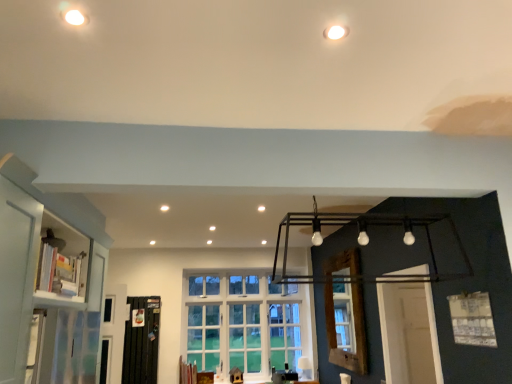
Question: Is black metal screen door at lower left positioned far away from white glass window at center, the first window in the left-to-right sequence?

Choices:
 (A) yes
 (B) no

Answer: (A)

Question: Does black metal screen door at lower left have a lesser height compared to white glass window at center, which is the 2th window in right-to-left order?

Choices:
 (A) yes
 (B) no

Answer: (A)

Question: Is black metal screen door at lower left not inside white glass window at center, which is the 2th window in right-to-left order?

Choices:
 (A) no
 (B) yes

Answer: (B)

Question: Considering the relative sizes of black metal screen door at lower left and white glass window at center, marked as the second window in a top-to-bottom arrangement, in the image provided, is black metal screen door at lower left wider than white glass window at center, marked as the second window in a top-to-bottom arrangement,?

Choices:
 (A) yes
 (B) no

Answer: (B)

Question: Is black metal screen door at lower left aimed at white glass window at center, marked as the second window in a top-to-bottom arrangement?

Choices:
 (A) yes
 (B) no

Answer: (B)

Question: Would you say white glossy bookshelf at left is to the left or to the right of wooden window frame at center in the picture?

Choices:
 (A) left
 (B) right

Answer: (A)

Question: Based on their sizes in the image, would you say white glossy bookshelf at left is bigger or smaller than wooden window frame at center?

Choices:
 (A) big
 (B) small

Answer: (B)

Question: Considering the positions of white glossy bookshelf at left and wooden window frame at center in the image, is white glossy bookshelf at left taller or shorter than wooden window frame at center?

Choices:
 (A) tall
 (B) short

Answer: (B)

Question: Relative to wooden window frame at center, is white glossy bookshelf at left in front or behind?

Choices:
 (A) behind
 (B) front

Answer: (B)

Question: From a real-world perspective, relative to black metal screen door at lower left, is white glossy bookshelf at left vertically above or below?

Choices:
 (A) below
 (B) above

Answer: (B)

Question: From their relative heights in the image, would you say white glossy bookshelf at left is taller or shorter than black metal screen door at lower left?

Choices:
 (A) tall
 (B) short

Answer: (A)

Question: Choose the correct answer: Is white glossy bookshelf at left inside black metal screen door at lower left or outside it?

Choices:
 (A) outside
 (B) inside

Answer: (A)

Question: In terms of width, does white glossy bookshelf at left look wider or thinner when compared to black metal screen door at lower left?

Choices:
 (A) thin
 (B) wide

Answer: (B)

Question: Is white glossy bookshelf at left inside the boundaries of white glass window at center, which is the 1th window in bottom-to-top order, or outside?

Choices:
 (A) inside
 (B) outside

Answer: (B)

Question: Considering the positions of white glossy bookshelf at left and white glass window at center, which is the second window in front-to-back order, in the image, is white glossy bookshelf at left wider or thinner than white glass window at center, which is the second window in front-to-back order,?

Choices:
 (A) thin
 (B) wide

Answer: (B)